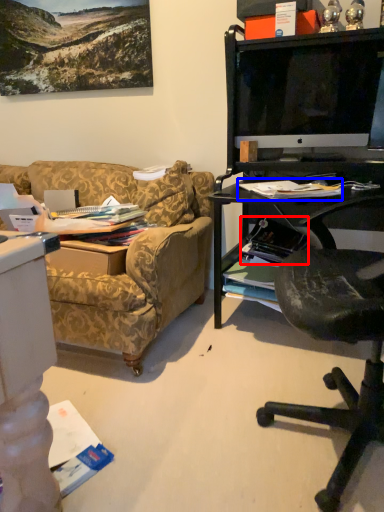
Question: Which object is further to the camera taking this photo, magazine (highlighted by a red box) or magazine (highlighted by a blue box)?

Choices:
 (A) magazine
 (B) magazine

Answer: (A)